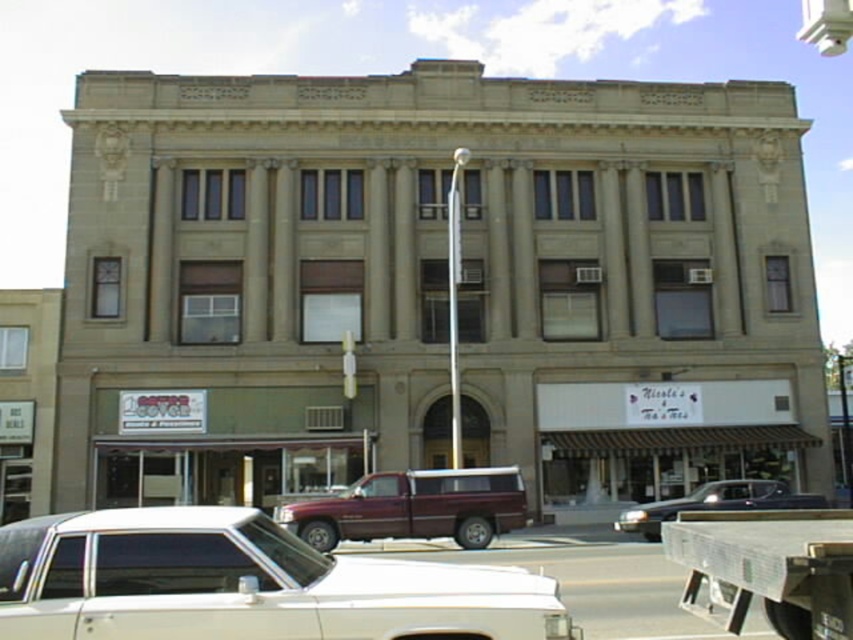
Is metallic silver truck bed at lower right smaller than metallic dark blue truck at center?

Actually, metallic silver truck bed at lower right might be larger than metallic dark blue truck at center.

From the picture: How distant is metallic silver truck bed at lower right from metallic dark blue truck at center?

metallic silver truck bed at lower right is 4.06 meters away from metallic dark blue truck at center.

The height and width of the screenshot is (640, 853). I want to click on metallic silver truck bed at lower right, so click(x=769, y=566).

Identify the location of metallic silver truck bed at lower right. Image resolution: width=853 pixels, height=640 pixels. (769, 566).

Can you confirm if white glossy car at center is wider than maroon metallic pickup truck at center?

Indeed, white glossy car at center has a greater width compared to maroon metallic pickup truck at center.

Between point (254, 612) and point (424, 468), which one is positioned in front?

Positioned in front is point (254, 612).

What are the coordinates of `white glossy car at center` in the screenshot? It's located at (247, 584).

Looking at this image, is white glossy car at center above metallic silver truck bed at lower right?

No, white glossy car at center is not above metallic silver truck bed at lower right.

Who is lower down, white glossy car at center or metallic silver truck bed at lower right?

white glossy car at center is lower down.

Is point (141, 604) positioned behind point (723, 600)?

No.

This screenshot has height=640, width=853. I want to click on white glossy car at center, so click(247, 584).